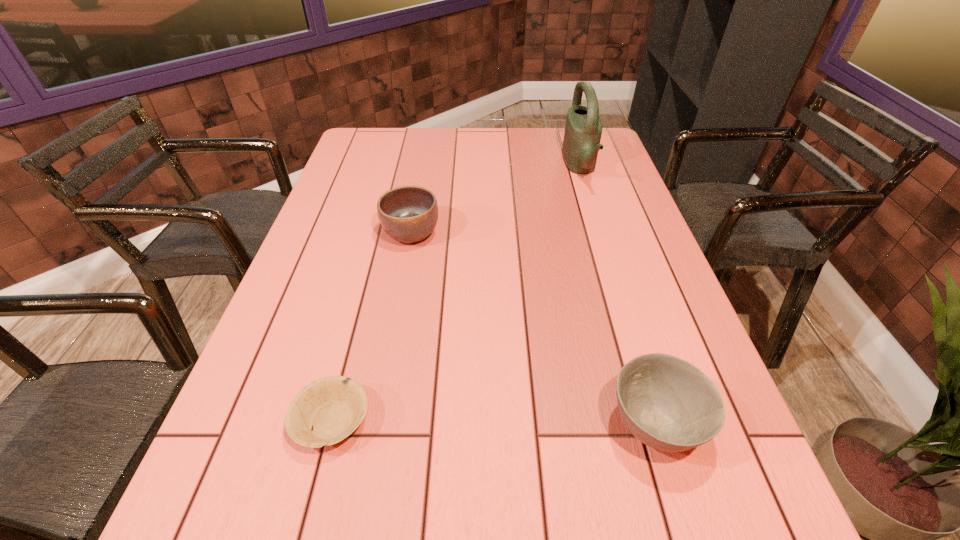
The width and height of the screenshot is (960, 540). Find the location of `empty location between the rightmost bowl and the farthest bowl`. empty location between the rightmost bowl and the farthest bowl is located at coordinates (533, 329).

The image size is (960, 540). Find the location of `object that is the third closest to the second farthest object`. object that is the third closest to the second farthest object is located at coordinates (667, 403).

Choose which object is the second nearest neighbor to the tallest object. Please provide its 2D coordinates. Your answer should be formatted as a tuple, i.e. [(x, y)], where the tuple contains the x and y coordinates of a point satisfying the conditions above.

[(667, 403)]

Where is `bowl that is the second closest to the rightmost bowl`? bowl that is the second closest to the rightmost bowl is located at coordinates [x=408, y=214].

Where is `bowl identified as the closest to the rightmost bowl`? The width and height of the screenshot is (960, 540). bowl identified as the closest to the rightmost bowl is located at coordinates (333, 407).

Where is `free spot that satisfies the following two spatial constraints: 1. on the spout of the farthest object; 2. on the front side of the farthest bowl`? The height and width of the screenshot is (540, 960). free spot that satisfies the following two spatial constraints: 1. on the spout of the farthest object; 2. on the front side of the farthest bowl is located at coordinates (601, 234).

The height and width of the screenshot is (540, 960). I want to click on vacant region that satisfies the following two spatial constraints: 1. on the spout of the watering can; 2. on the front side of the rightmost bowl, so click(662, 426).

What are the coordinates of `vacant space that satisfies the following two spatial constraints: 1. on the spout of the tallest object; 2. on the front side of the shortest object` in the screenshot? It's located at (660, 421).